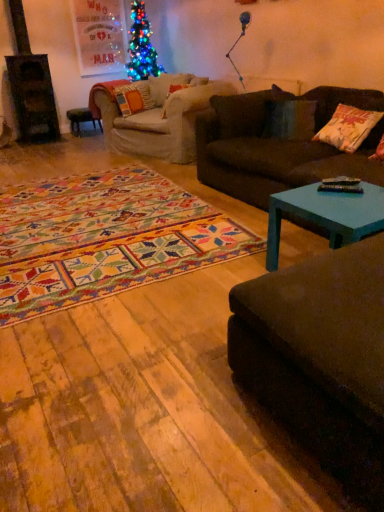
Question: Considering the positions of teal painted wood coffee table at lower right and velvet dark brown couch at lower right, the 2th studio couch when ordered from back to front, in the image, is teal painted wood coffee table at lower right wider or thinner than velvet dark brown couch at lower right, the 2th studio couch when ordered from back to front,?

Choices:
 (A) wide
 (B) thin

Answer: (B)

Question: Is teal painted wood coffee table at lower right inside or outside of velvet dark brown couch at lower right, the 2th studio couch when ordered from back to front?

Choices:
 (A) inside
 (B) outside

Answer: (B)

Question: Which object is positioned closest to the teal painted wood coffee table at lower right?

Choices:
 (A) matte black stool at left
 (B) velvet dark brown couch at lower right, arranged as the 1th studio couch when viewed from the front
 (C) white cotton pillow at right, which is the second pillow from top to bottom
 (D) dark brown fabric couch at center, the second studio couch in the front-to-back sequence
 (E) velvet orange pillow at center, positioned as the first pillow in back-to-front order

Answer: (B)

Question: Which of these objects is positioned farthest from the velvet dark brown couch at lower right, placed as the 1th studio couch when sorted from bottom to top?

Choices:
 (A) white cotton pillow at right, which is the first pillow from right to left
 (B) matte black stool at left
 (C) teal painted wood coffee table at lower right
 (D) dark brown fabric couch at center, the 1th studio couch from the top
 (E) velvet orange pillow at center, which is the first pillow in top-to-bottom order

Answer: (B)